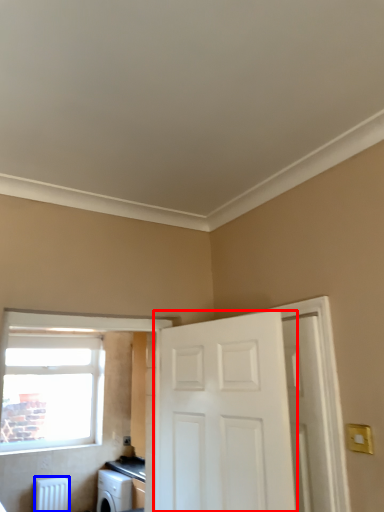
Question: Which object is closer to the camera taking this photo, door (highlighted by a red box) or radiator (highlighted by a blue box)?

Choices:
 (A) door
 (B) radiator

Answer: (A)